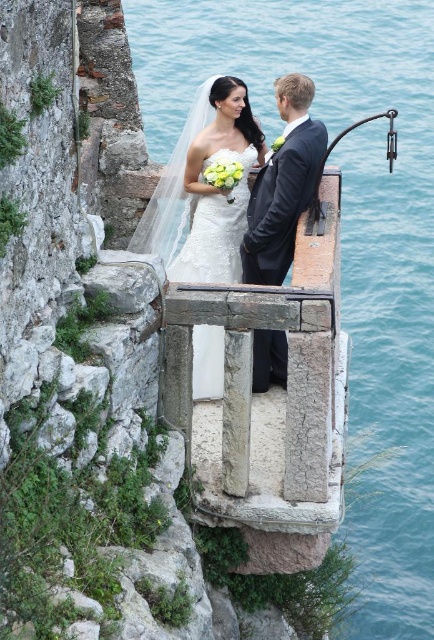
You are a photographer positioned behind the couple to capture their wedding photo. You need to adjust your camera focus so that both the satin white dress at center and the matte black suit at center are in sharp focus. Which object should you focus on first to ensure both are clear?

You should focus on the satin white dress at center first because it is closer to you than the matte black suit at center, ensuring both will be in focus when using proper depth of field.

You are a photographer at the cliffside wedding. You need to ensure the bride in the satin white dress at center and the groom in the matte black suit at center are framed properly. Which of their outfits will be more visible in the photo due to their positioning?

The satin white dress at center will be more visible because it is positioned over the matte black suit at center, making it stand out in the frame.